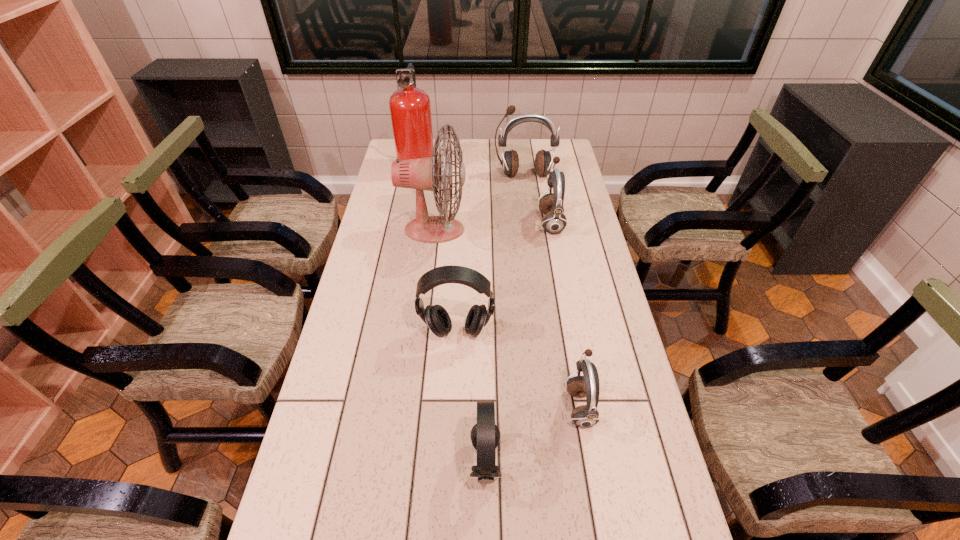
Find the location of a particular element. The width and height of the screenshot is (960, 540). vacant space located 0.330m on the ear cups of the nearer black earphone is located at coordinates (325, 461).

Where is `free space located 0.220m on the ear cups of the nearer black earphone`? The height and width of the screenshot is (540, 960). free space located 0.220m on the ear cups of the nearer black earphone is located at coordinates (373, 461).

I want to click on vacant region located on the ear cups of the nearer black earphone, so click(x=382, y=461).

Locate an element on the screen. This screenshot has width=960, height=540. object that is at the far edge is located at coordinates (410, 109).

Identify the location of fire extinguisher that is at the left edge. (410, 109).

This screenshot has height=540, width=960. What are the coordinates of `fan that is at the left edge` in the screenshot? It's located at (421, 174).

The width and height of the screenshot is (960, 540). Identify the location of object situated at the far left corner. (410, 109).

In the image, there is a desktop. Where is `vacant space at the far edge`? The width and height of the screenshot is (960, 540). vacant space at the far edge is located at coordinates (525, 141).

The height and width of the screenshot is (540, 960). I want to click on free space at the left edge of the desktop, so click(369, 444).

At what (x,y) coordinates should I click in order to perform the action: click on vacant space at the right edge of the desktop. Please return your answer as a coordinate pair (x, y). This screenshot has width=960, height=540. Looking at the image, I should click on (660, 511).